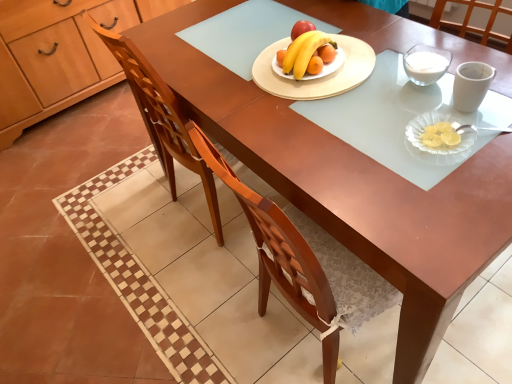
Where is `vacant space in between wooden round platter at center, which is the second platter in front-to-back order, and clear glass platter at lower right, which appears as the second platter when viewed from the left`? This screenshot has height=384, width=512. vacant space in between wooden round platter at center, which is the second platter in front-to-back order, and clear glass platter at lower right, which appears as the second platter when viewed from the left is located at coordinates tap(385, 105).